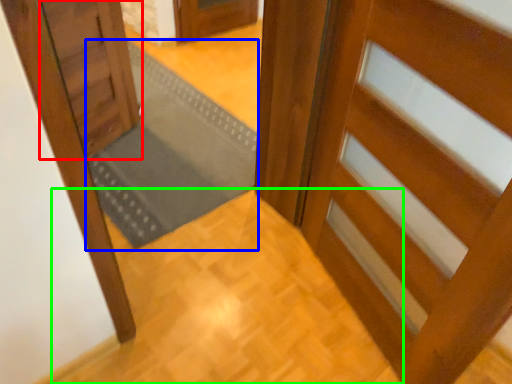
Question: Which object is positioned closest to door (highlighted by a red box)? Select from doormat (highlighted by a blue box) and path (highlighted by a green box).

Choices:
 (A) doormat
 (B) path

Answer: (A)